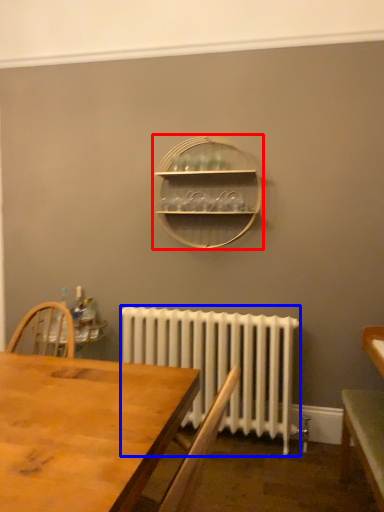
Question: Among these objects, which one is farthest to the camera, shelf (highlighted by a red box) or radiator (highlighted by a blue box)?

Choices:
 (A) shelf
 (B) radiator

Answer: (A)